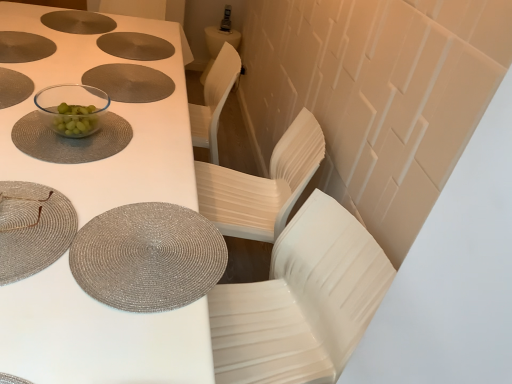
Question: In terms of width, does transparent glass bowl at center, which appears as the 3th tableware when viewed from the front, look wider or thinner when compared to silver woven placemat at lower left, arranged as the 2th tableware when ordered from the bottom?

Choices:
 (A) wide
 (B) thin

Answer: (A)

Question: From the image's perspective, is transparent glass bowl at center, which appears as the 3th tableware when viewed from the front, positioned above or below silver woven placemat at lower left, which is the first tableware in front-to-back order?

Choices:
 (A) above
 (B) below

Answer: (A)

Question: Which is farther from the matte silver placemat at upper center, the 1th tableware positioned from the back?

Choices:
 (A) silver textured placemat at lower left, the 2th tableware positioned from the front
 (B) silver woven placemat at lower left, acting as the fourth tableware starting from the top
 (C) transparent glass bowl at center, placed as the fourth tableware when sorted from bottom to top
 (D) white textured table at center
 (E) matte silver placemat at center

Answer: (A)

Question: Which of these objects is positioned farthest from the white glossy chair at center?

Choices:
 (A) transparent glass bowl at center, which appears as the 2th tableware when viewed from the back
 (B) silver textured placemat at lower left, the 2th tableware positioned from the front
 (C) silver woven placemat at lower left, positioned as the 5th tableware in back-to-front order
 (D) matte silver placemat at upper center, the fifth tableware when ordered from bottom to top
 (E) matte silver placemat at center

Answer: (D)